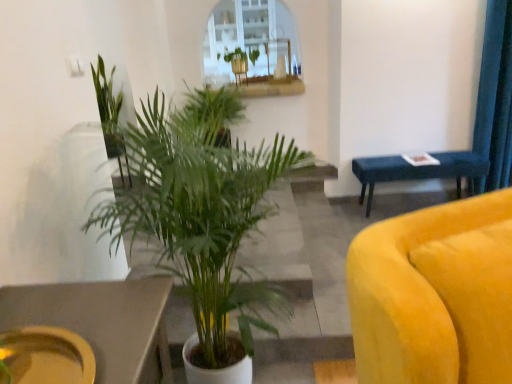
The image size is (512, 384). Find the location of `green leafy plant at upper center, which ranks as the 1th houseplant in back-to-front order`. green leafy plant at upper center, which ranks as the 1th houseplant in back-to-front order is located at coordinates (240, 59).

Identify the location of green leafy plant at upper left, the second houseplant from the back. (108, 108).

At what (x,y) coordinates should I click in order to perform the action: click on blue fabric bench at right. Please return your answer as a coordinate pair (x, y). Looking at the image, I should click on (420, 171).

Describe the element at coordinates (420, 171) in the screenshot. I see `blue fabric bench at right` at that location.

Where is `matte yellow platter at lower left`? This screenshot has height=384, width=512. matte yellow platter at lower left is located at coordinates (47, 356).

Find the location of a particular element. houseplant lying behind the green leafy plant at upper left, which ranks as the third houseplant in front-to-back order is located at coordinates (240, 59).

From the picture: Is green leafy plant at upper left, the second houseplant from the back, taller than green leafy plant at upper center, which ranks as the 1th houseplant in back-to-front order?

Yes.

From the image's perspective, would you say green leafy plant at upper left, the second houseplant from the back, is positioned over green leafy plant at upper center, which appears as the fourth houseplant when viewed from the front?

Actually, green leafy plant at upper left, the second houseplant from the back, appears below green leafy plant at upper center, which appears as the fourth houseplant when viewed from the front, in the image.

Is green leafy plant at upper left, the second houseplant from the back, facing towards green leafy plant at upper center, which appears as the fourth houseplant when viewed from the front?

No, green leafy plant at upper left, the second houseplant from the back, is not facing towards green leafy plant at upper center, which appears as the fourth houseplant when viewed from the front.

Is green leafy plant at center, which is the first houseplant in front-to-back order, taller than blue fabric bench at right?

Correct, green leafy plant at center, which is the first houseplant in front-to-back order, is much taller as blue fabric bench at right.

The width and height of the screenshot is (512, 384). In order to click on table behind the green leafy plant at center, which is the first houseplant in front-to-back order in this screenshot , I will do `click(420, 171)`.

Between point (205, 322) and point (458, 177), which one is positioned behind?

The point (458, 177) is farther from the camera.

From a real-world perspective, is green leafy plant at center, which is the first houseplant in front-to-back order, physically located above or below blue fabric bench at right?

green leafy plant at center, which is the first houseplant in front-to-back order, is above blue fabric bench at right.

Is point (195, 311) farther from viewer compared to point (106, 135)?

That is False.

From the image's perspective, which one is positioned lower, green leafy plant at center, which is the first houseplant in front-to-back order, or green leafy plant at upper left, which ranks as the third houseplant in front-to-back order?

green leafy plant at center, which is the first houseplant in front-to-back order.

From the picture: Considering the positions of objects green leafy plant at center, positioned as the fourth houseplant in back-to-front order, and green leafy plant at upper left, which ranks as the third houseplant in front-to-back order, in the image provided, who is more to the right, green leafy plant at center, positioned as the fourth houseplant in back-to-front order, or green leafy plant at upper left, which ranks as the third houseplant in front-to-back order,?

green leafy plant at center, positioned as the fourth houseplant in back-to-front order, is more to the right.

Is green leafy plant at center, positioned as the fourth houseplant in back-to-front order, touching green leafy plant at upper left, the second houseplant from the back?

There is a gap between green leafy plant at center, positioned as the fourth houseplant in back-to-front order, and green leafy plant at upper left, the second houseplant from the back.

Are matte yellow platter at lower left and green leafy plant at upper center, which appears as the fourth houseplant when viewed from the front, making contact?

No, matte yellow platter at lower left is not next to green leafy plant at upper center, which appears as the fourth houseplant when viewed from the front.

Does matte yellow platter at lower left come behind green leafy plant at upper center, which appears as the fourth houseplant when viewed from the front?

No, matte yellow platter at lower left is closer to the camera.

Between matte yellow platter at lower left and green leafy plant at upper center, which ranks as the 1th houseplant in back-to-front order, which one has less height?

matte yellow platter at lower left is shorter.

Is matte yellow platter at lower left oriented towards green leafy plant at upper center, which ranks as the 1th houseplant in back-to-front order?

No, matte yellow platter at lower left does not turn towards green leafy plant at upper center, which ranks as the 1th houseplant in back-to-front order.

From a real-world perspective, is matte yellow platter at lower left physically located above or below green leafy plant at center, which is the 3th houseplant from back to front?

matte yellow platter at lower left is below green leafy plant at center, which is the 3th houseplant from back to front.

Does point (3, 358) lie behind point (212, 134)?

No, it is in front of (212, 134).

Would you say matte yellow platter at lower left is a long distance from green leafy plant at center, which is the 3th houseplant from back to front?

matte yellow platter at lower left is positioned a significant distance from green leafy plant at center, which is the 3th houseplant from back to front.

Is matte yellow platter at lower left bigger or smaller than green leafy plant at center, which appears as the 2th houseplant when viewed from the front?

Clearly, matte yellow platter at lower left is smaller in size than green leafy plant at center, which appears as the 2th houseplant when viewed from the front.

From their relative heights in the image, would you say green leafy plant at upper left, the second houseplant from the back, is taller or shorter than green leafy plant at center, which appears as the 2th houseplant when viewed from the front?

green leafy plant at upper left, the second houseplant from the back, is taller than green leafy plant at center, which appears as the 2th houseplant when viewed from the front.

From a real-world perspective, between green leafy plant at upper left, the second houseplant from the back, and green leafy plant at center, which is the 3th houseplant from back to front, who is vertically lower?

green leafy plant at center, which is the 3th houseplant from back to front, from a real-world perspective.

From a real-world perspective, count 1st houseplants upward from the green leafy plant at center, which is the 3th houseplant from back to front, and point to it. Please provide its 2D coordinates.

[(108, 108)]

Does green leafy plant at upper left, which ranks as the third houseplant in front-to-back order, have a smaller size compared to green leafy plant at center, which appears as the 2th houseplant when viewed from the front?

Yes, green leafy plant at upper left, which ranks as the third houseplant in front-to-back order, is smaller than green leafy plant at center, which appears as the 2th houseplant when viewed from the front.

Does point (106, 148) come in front of point (33, 376)?

That is False.

Can you confirm if green leafy plant at upper left, the second houseplant from the back, is wider than matte yellow platter at lower left?

Yes, green leafy plant at upper left, the second houseplant from the back, is wider than matte yellow platter at lower left.

Can you confirm if green leafy plant at upper left, which ranks as the third houseplant in front-to-back order, is bigger than matte yellow platter at lower left?

Indeed, green leafy plant at upper left, which ranks as the third houseplant in front-to-back order, has a larger size compared to matte yellow platter at lower left.

Considering the positions of objects green leafy plant at upper left, which ranks as the third houseplant in front-to-back order, and matte yellow platter at lower left in the image provided, who is more to the right, green leafy plant at upper left, which ranks as the third houseplant in front-to-back order, or matte yellow platter at lower left?

matte yellow platter at lower left.

Locate an element on the screen. Image resolution: width=512 pixels, height=384 pixels. the 3rd houseplant to the left when counting from the green leafy plant at upper center, which ranks as the 1th houseplant in back-to-front order is located at coordinates (108, 108).

Where is `houseplant that is the 3rd object located in front of the blue fabric bench at right`? The width and height of the screenshot is (512, 384). houseplant that is the 3rd object located in front of the blue fabric bench at right is located at coordinates (201, 210).

Estimate the real-world distances between objects in this image. Which object is closer to green leafy plant at upper left, which ranks as the third houseplant in front-to-back order, green leafy plant at upper center, which ranks as the 1th houseplant in back-to-front order, or green leafy plant at center, which is the first houseplant in front-to-back order?

green leafy plant at center, which is the first houseplant in front-to-back order, is closer to green leafy plant at upper left, which ranks as the third houseplant in front-to-back order.

Consider the image. Considering their positions, is green leafy plant at upper left, which ranks as the third houseplant in front-to-back order, positioned closer to green leafy plant at upper center, which appears as the fourth houseplant when viewed from the front, than green leafy plant at center, positioned as the fourth houseplant in back-to-front order?

The object closer to green leafy plant at upper center, which appears as the fourth houseplant when viewed from the front, is green leafy plant at upper left, which ranks as the third houseplant in front-to-back order.

Based on their spatial positions, is green leafy plant at center, which is the 3th houseplant from back to front, or green leafy plant at upper left, the second houseplant from the back, further from green leafy plant at upper center, which appears as the fourth houseplant when viewed from the front?

green leafy plant at upper left, the second houseplant from the back.

Based on their spatial positions, is matte yellow platter at lower left or green leafy plant at upper left, the second houseplant from the back, further from blue fabric bench at right?

matte yellow platter at lower left is further to blue fabric bench at right.

Estimate the real-world distances between objects in this image. Which object is further from matte yellow platter at lower left, green leafy plant at center, which appears as the 2th houseplant when viewed from the front, or green leafy plant at center, positioned as the fourth houseplant in back-to-front order?

green leafy plant at center, which appears as the 2th houseplant when viewed from the front, lies further to matte yellow platter at lower left than the other object.

Based on their spatial positions, is green leafy plant at center, which is the first houseplant in front-to-back order, or blue fabric bench at right further from green leafy plant at upper center, which ranks as the 1th houseplant in back-to-front order?

Among the two, green leafy plant at center, which is the first houseplant in front-to-back order, is located further to green leafy plant at upper center, which ranks as the 1th houseplant in back-to-front order.

Based on their spatial positions, is green leafy plant at upper center, which appears as the fourth houseplant when viewed from the front, or green leafy plant at upper left, the second houseplant from the back, further from blue fabric bench at right?

green leafy plant at upper left, the second houseplant from the back, is further to blue fabric bench at right.

Looking at the image, which one is located further to green leafy plant at center, which is the 3th houseplant from back to front, green leafy plant at upper left, the second houseplant from the back, or blue fabric bench at right?

blue fabric bench at right.

Locate an element on the screen. The image size is (512, 384). table between matte yellow platter at lower left and green leafy plant at upper center, which appears as the fourth houseplant when viewed from the front, from front to back is located at coordinates (420, 171).

The width and height of the screenshot is (512, 384). I want to click on table between green leafy plant at center, which is the first houseplant in front-to-back order, and green leafy plant at upper center, which appears as the fourth houseplant when viewed from the front, along the z-axis, so click(x=420, y=171).

You are a GUI agent. You are given a task and a screenshot of the screen. Output one action in this format:
    pyautogui.click(x=<x>, y=<y>)
    Task: Click on the houseplant positioned between matte yellow platter at lower left and green leafy plant at center, which is the 3th houseplant from back to front, from near to far
    This screenshot has width=512, height=384.
    Given the screenshot: What is the action you would take?
    pyautogui.click(x=201, y=210)

Find the location of a particular element. Image resolution: width=512 pixels, height=384 pixels. houseplant positioned between green leafy plant at center, positioned as the fourth houseplant in back-to-front order, and green leafy plant at upper left, which ranks as the third houseplant in front-to-back order, from near to far is located at coordinates (214, 113).